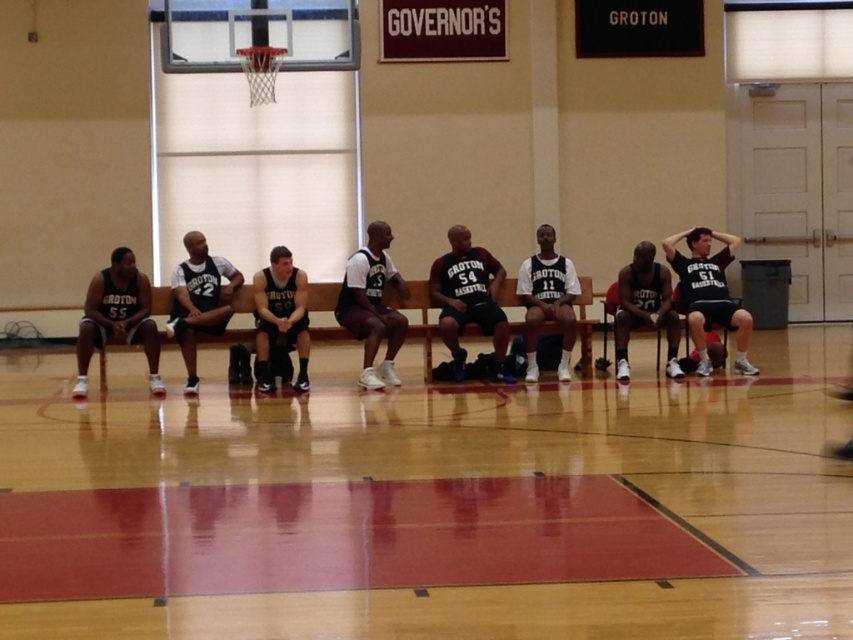
Question: Which object is the farthest from the dark gray jersey at center?

Choices:
 (A) black jersey at center
 (B) wooden floor at center
 (C) matte black jersey at center
 (D) white mesh shorts at center

Answer: (C)

Question: Which point is farther to the camera?

Choices:
 (A) (299, 346)
 (B) (380, 362)
 (C) (703, 252)
 (D) (399, 600)

Answer: (C)

Question: Does wooden floor at center appear on the left side of black jersey at center?

Choices:
 (A) yes
 (B) no

Answer: (A)

Question: Can you confirm if matte black shorts at left is positioned to the right of matte black basketball at right?

Choices:
 (A) yes
 (B) no

Answer: (B)

Question: Does dark gray jersey at center have a lesser width compared to matte gray jersey at center?

Choices:
 (A) yes
 (B) no

Answer: (B)

Question: Which point is closer to the camera?

Choices:
 (A) (144, 333)
 (B) (744, 525)
 (C) (502, 289)
 (D) (387, 310)

Answer: (B)